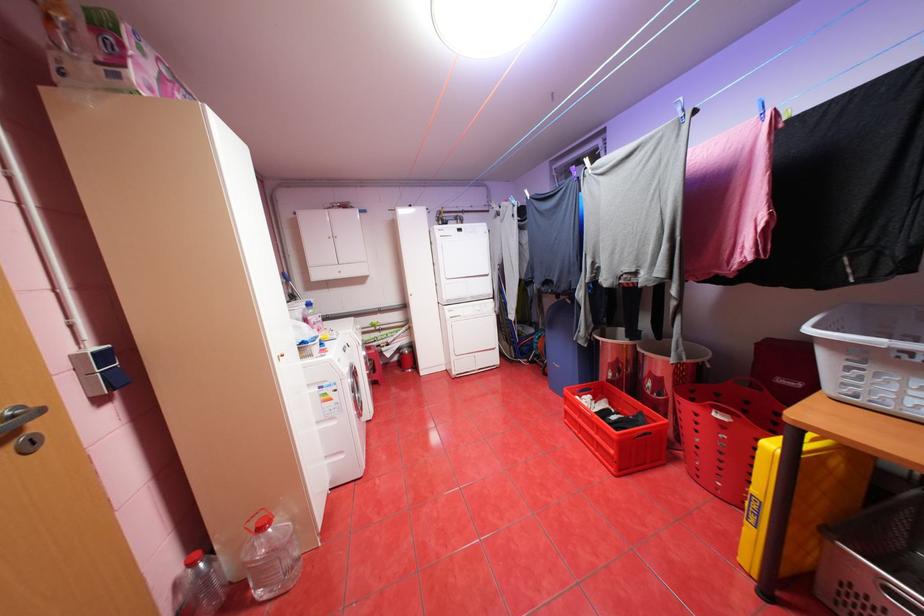
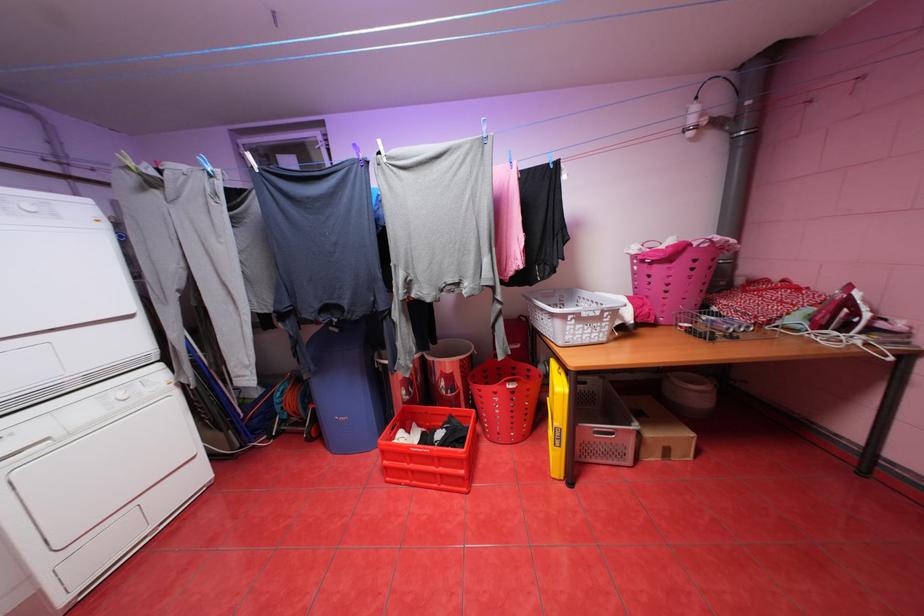
Question: The first image is from the beginning of the video and the second image is from the end. How did the camera likely rotate when shooting the video?

Choices:
 (A) Left
 (B) Right
 (C) Up
 (D) Down

Answer: (B)